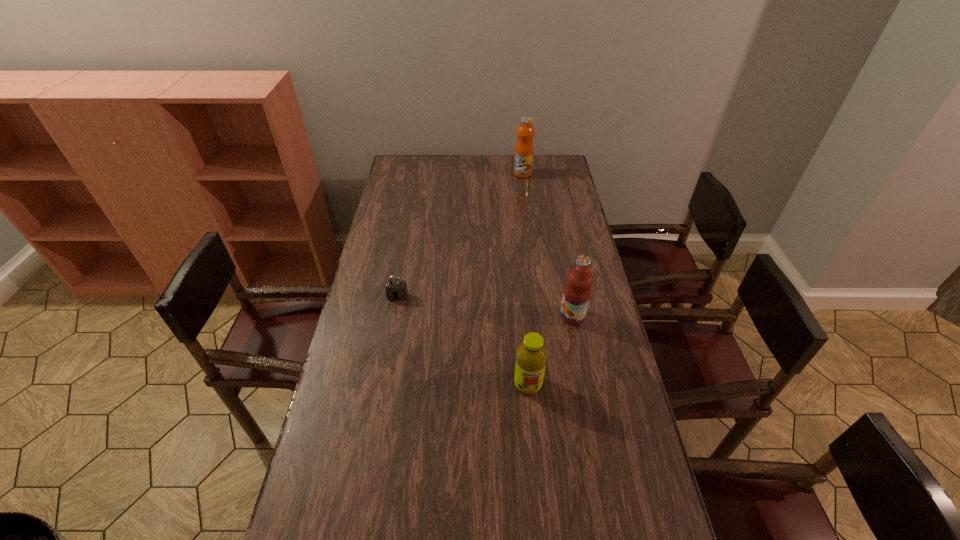
The height and width of the screenshot is (540, 960). Find the location of `vacant space located on the front label of the third farthest object`. vacant space located on the front label of the third farthest object is located at coordinates (482, 316).

Image resolution: width=960 pixels, height=540 pixels. Identify the location of vacant space located 0.210m on the front label of the nearest fruit juice. (x=536, y=468).

Where is `vacant space situated at the front of the second farthest object near the keyhole`? vacant space situated at the front of the second farthest object near the keyhole is located at coordinates (395, 316).

Locate an element on the screen. This screenshot has height=540, width=960. object that is at the far edge is located at coordinates (524, 150).

The image size is (960, 540). I want to click on object located in the left edge section of the desktop, so click(396, 290).

Locate an element on the screen. The height and width of the screenshot is (540, 960). object located in the right edge section of the desktop is located at coordinates (577, 291).

In the image, there is a desktop. At what (x,y) coordinates should I click in order to perform the action: click on vacant space at the far edge. Please return your answer as a coordinate pair (x, y). This screenshot has height=540, width=960. Looking at the image, I should click on (496, 162).

The width and height of the screenshot is (960, 540). Find the location of `vacant space at the left edge of the desktop`. vacant space at the left edge of the desktop is located at coordinates (373, 246).

In the image, there is a desktop. Where is `vacant space at the right edge`? The height and width of the screenshot is (540, 960). vacant space at the right edge is located at coordinates (563, 196).

At what (x,y) coordinates should I click in order to perform the action: click on blank area at the far left corner. Please return your answer as a coordinate pair (x, y). Image resolution: width=960 pixels, height=540 pixels. Looking at the image, I should click on (410, 163).